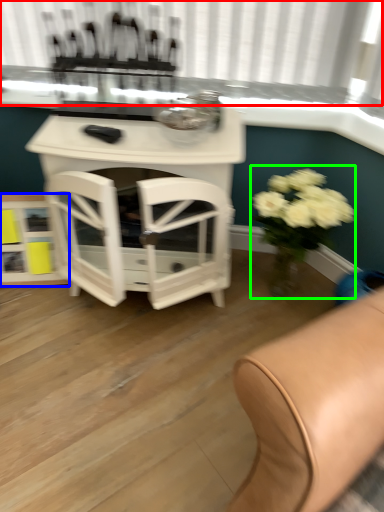
Question: Considering the real-world distances, which object is closest to bay window (highlighted by a red box)? shelf (highlighted by a blue box) or floral arrangement (highlighted by a green box).

Choices:
 (A) shelf
 (B) floral arrangement

Answer: (B)